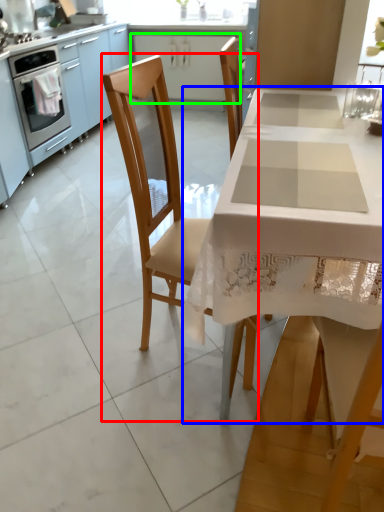
Question: Considering the real-world distances, which object is closest to chair (highlighted by a red box)? table (highlighted by a blue box) or cabinetry (highlighted by a green box).

Choices:
 (A) table
 (B) cabinetry

Answer: (A)